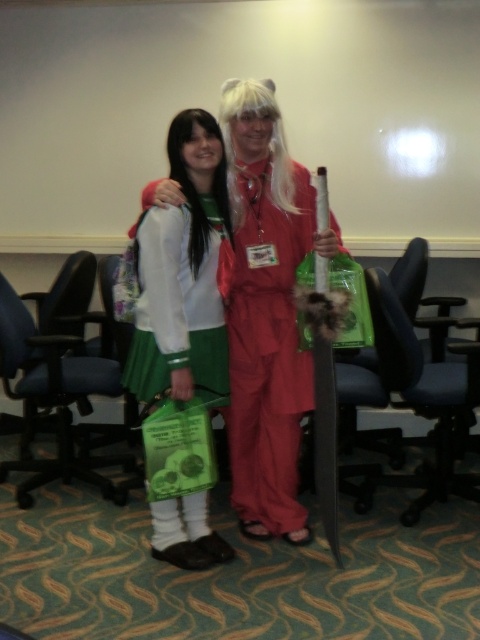
Who is more distant from viewer, (142, 340) or (292, 182)?

Point (292, 182)

Is point (206, 234) more distant than point (227, 173)?

No, it is in front of (227, 173).

I want to click on green fabric skirt at center, so click(184, 273).

Can you confirm if matte red jumpsuit at center is taller than green fabric skirt at center?

Indeed, matte red jumpsuit at center has a greater height compared to green fabric skirt at center.

Does matte red jumpsuit at center appear on the right side of green fabric skirt at center?

Yes, matte red jumpsuit at center is to the right of green fabric skirt at center.

Is point (285, 371) positioned behind point (175, 324)?

Yes, it is.

Locate an element on the screen. matte red jumpsuit at center is located at coordinates (266, 310).

Is matte red jumpsuit at center wider than white silky wig at center?

Yes.

Is matte red jumpsuit at center thinner than white silky wig at center?

Incorrect, matte red jumpsuit at center's width is not less than white silky wig at center's.

Where is `matte red jumpsuit at center`? This screenshot has width=480, height=640. matte red jumpsuit at center is located at coordinates (266, 310).